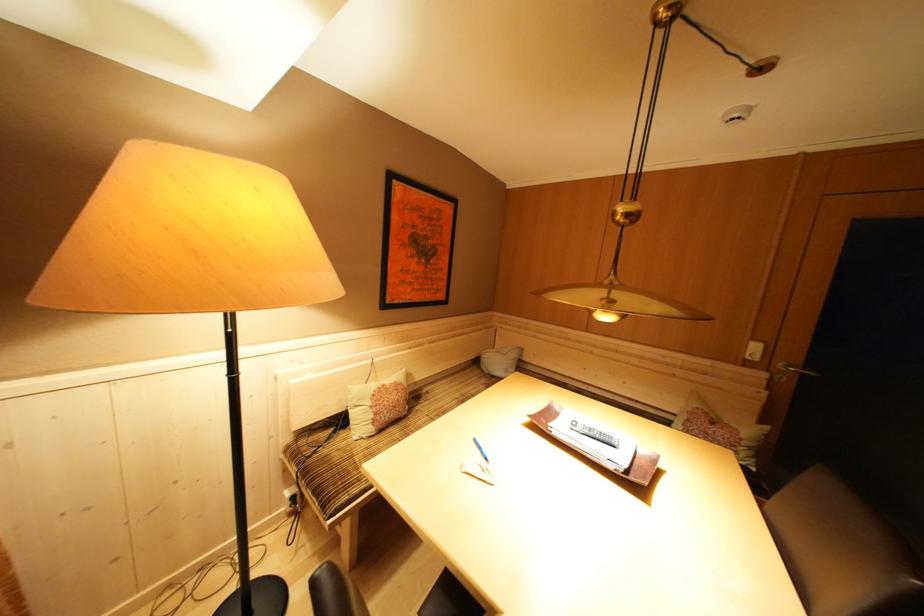
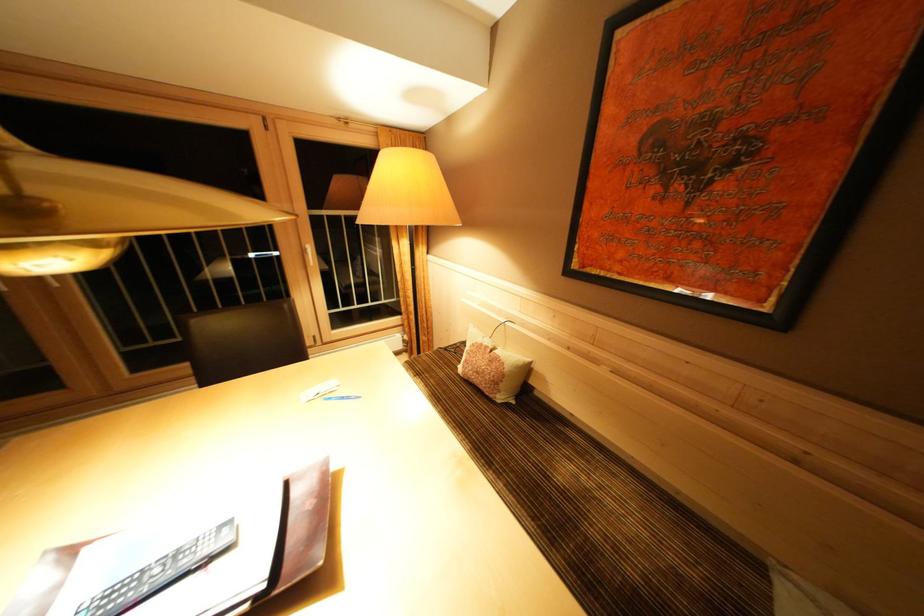
Locate, in the second image, the point that corresponds to the point at 390,391 in the first image.

(493, 352)